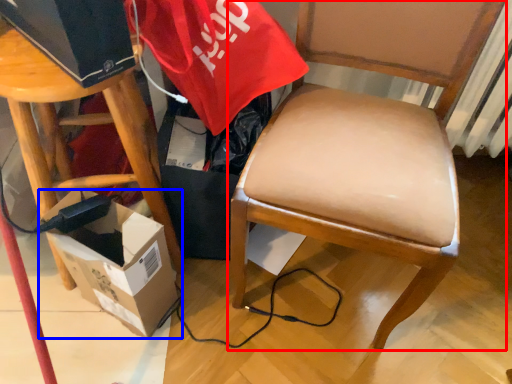
Question: Which object is closer to the camera taking this photo, chair (highlighted by a red box) or box (highlighted by a blue box)?

Choices:
 (A) chair
 (B) box

Answer: (A)